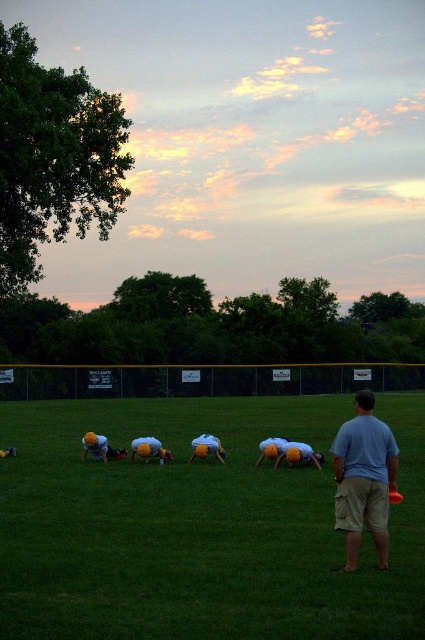
Is green grass at center positioned in front of orange plastic frisbee at center?

Yes, green grass at center is closer to the viewer.

Describe the element at coordinates (198, 528) in the screenshot. I see `green grass at center` at that location.

The width and height of the screenshot is (425, 640). I want to click on green grass at center, so click(198, 528).

From the picture: Is green grass at center positioned before yellow fabric shirt at center?

Yes, green grass at center is closer to the viewer.

Between point (334, 540) and point (212, 449), which one is positioned in front?

Point (334, 540)

The image size is (425, 640). In order to click on green grass at center in this screenshot , I will do `click(198, 528)`.

Does yellow fabric helmet at lower left lie in front of yellow fabric shirt at center?

No, yellow fabric helmet at lower left is further to the viewer.

Which of these two, yellow fabric helmet at lower left or yellow fabric shirt at center, stands taller?

With more height is yellow fabric helmet at lower left.

Which is behind, point (110, 451) or point (206, 435)?

The point (110, 451) is behind.

Locate an element on the screen. This screenshot has height=640, width=425. yellow fabric helmet at lower left is located at coordinates (99, 448).